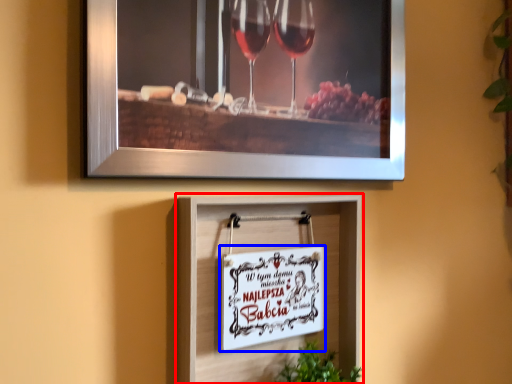
Question: Which object is further to the camera taking this photo, picture frame (highlighted by a red box) or picture frame (highlighted by a blue box)?

Choices:
 (A) picture frame
 (B) picture frame

Answer: (B)